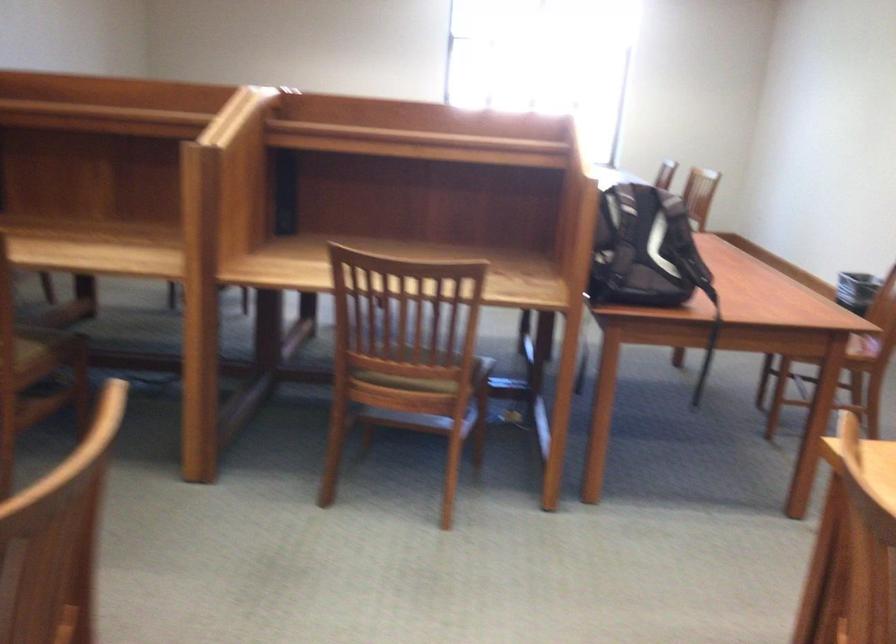
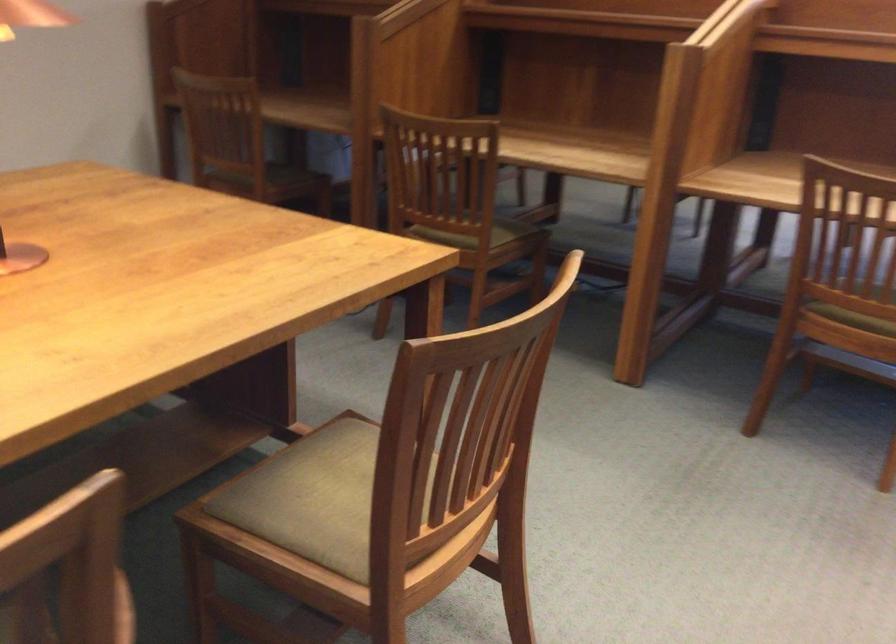
Question: How did the camera likely rotate?

Choices:
 (A) Left
 (B) Right
 (C) Up
 (D) Down

Answer: (A)